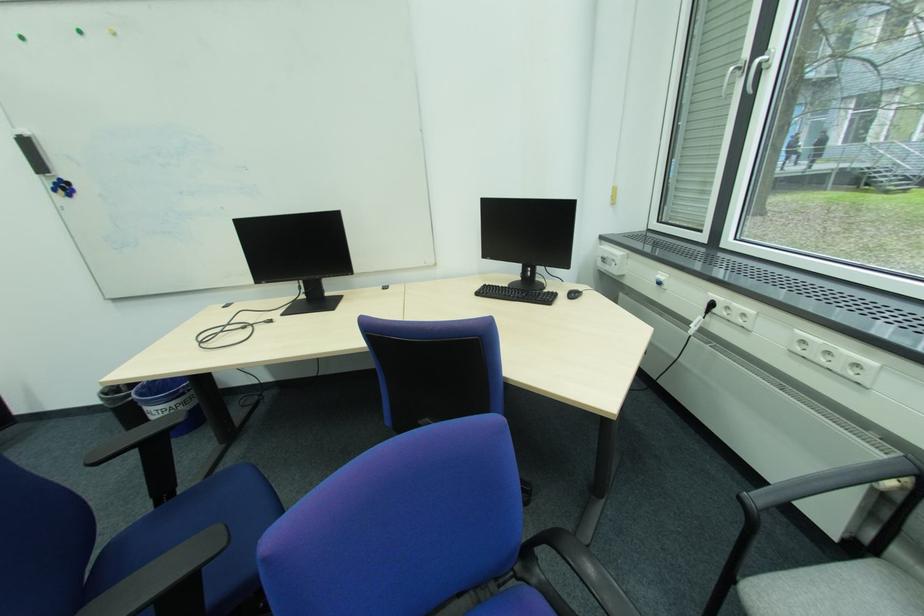
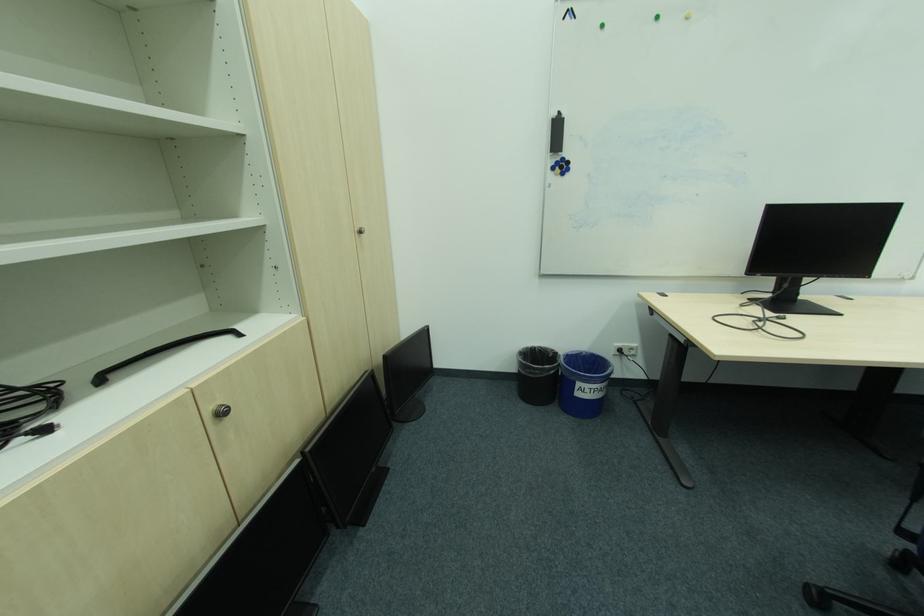
Where in the second image is the point corresponding to the point at 62,185 from the first image?

(565, 163)